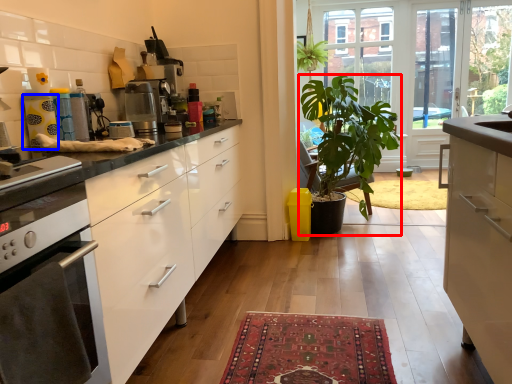
Question: Which object is further to the camera taking this photo, houseplant (highlighted by a red box) or appliance (highlighted by a blue box)?

Choices:
 (A) houseplant
 (B) appliance

Answer: (A)